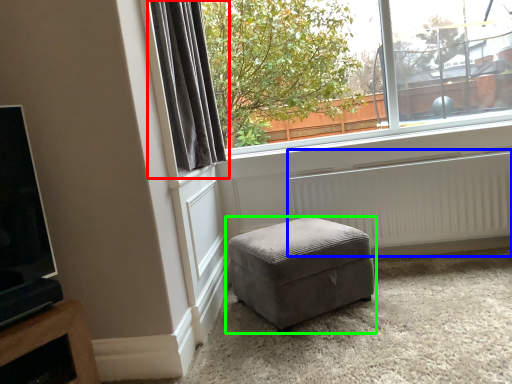
Question: Based on their relative distances, which object is farther from curtain (highlighted by a red box)? Choose from radiator (highlighted by a blue box) and studio couch (highlighted by a green box).

Choices:
 (A) radiator
 (B) studio couch

Answer: (A)